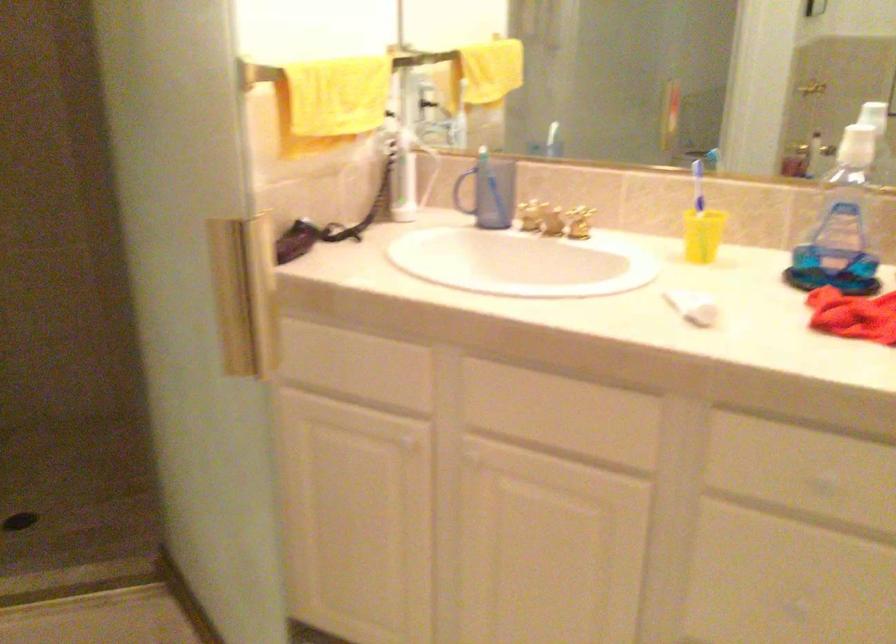
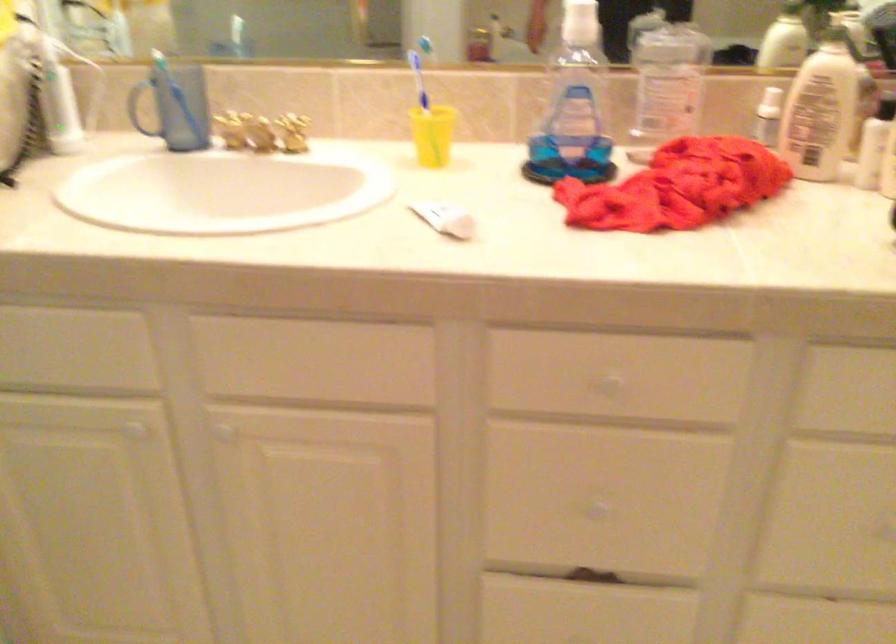
Locate, in the second image, the point that corresponds to the point at 709,156 in the first image.

(426, 46)